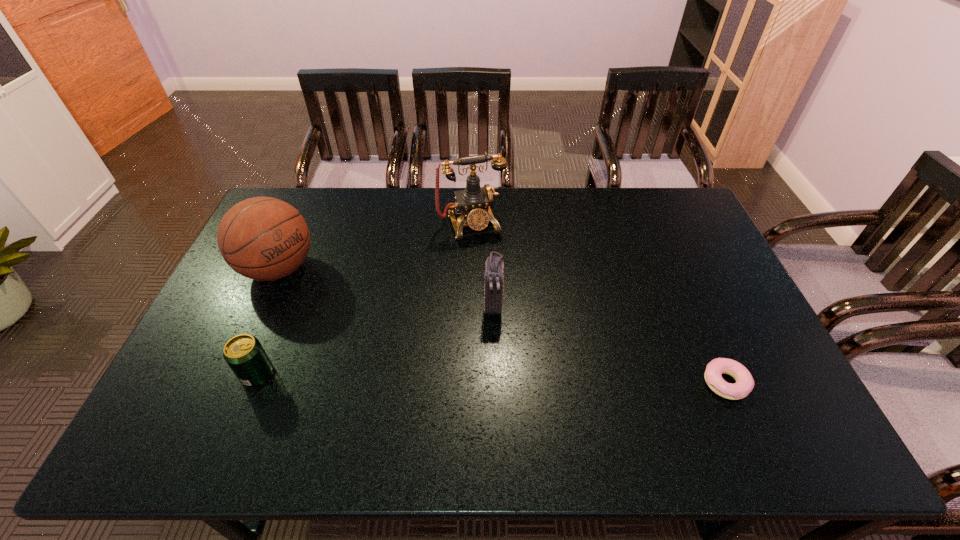
Find the location of `vacant spot on the desktop that is between the second shortest object and the shortest object and is positioned on the side with brand label of the basketball`. vacant spot on the desktop that is between the second shortest object and the shortest object and is positioned on the side with brand label of the basketball is located at coordinates (429, 377).

Locate an element on the screen. The image size is (960, 540). free space on the desktop that is between the beer can and the shortest object and is positioned with the zip open on the third shortest object is located at coordinates (489, 379).

What are the coordinates of `vacant spot on the desktop that is between the second shortest object and the rightmost object and is positioned on the front of the telephone, featuring the rotary dial` in the screenshot? It's located at (530, 379).